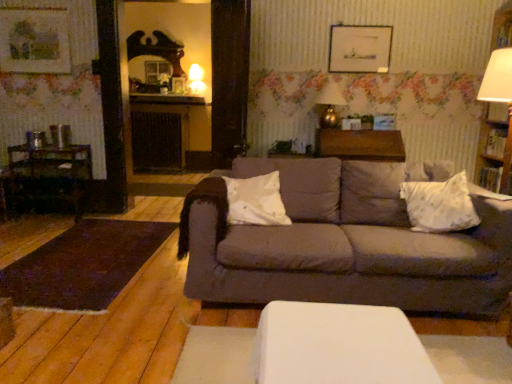
Find the location of a particular element. This screenshot has height=384, width=512. vacant area situated to the left side of matte gray couch at center is located at coordinates (97, 291).